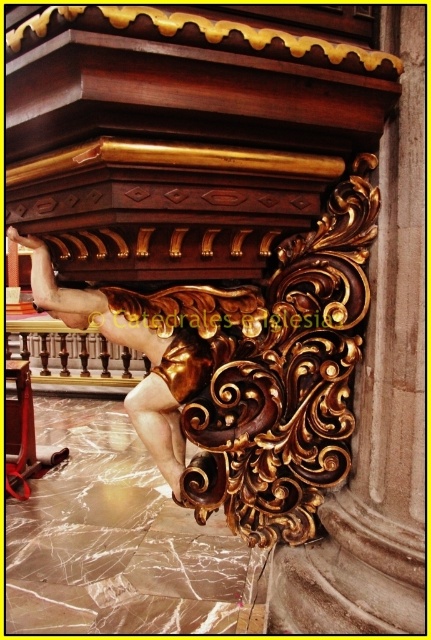
You are an art conservator examining the gilded wood carving in the cathedral. You notice two points on the carving labeled as point (303, 291) and point (168, 374). Which point is nearer to your viewpoint as you face the carving?

Point (303, 291) is closer to the camera than point (168, 374), so the point (303, 291) is nearer to your viewpoint.

You are an art conservator examining the intricate wood carvings in a cathedral. You notice a specific point marked at coordinates (274, 371). Based on the scene description, what object or feature is located at this point?

The point at coordinates (274, 371) corresponds to the gold polished wood carving at center.